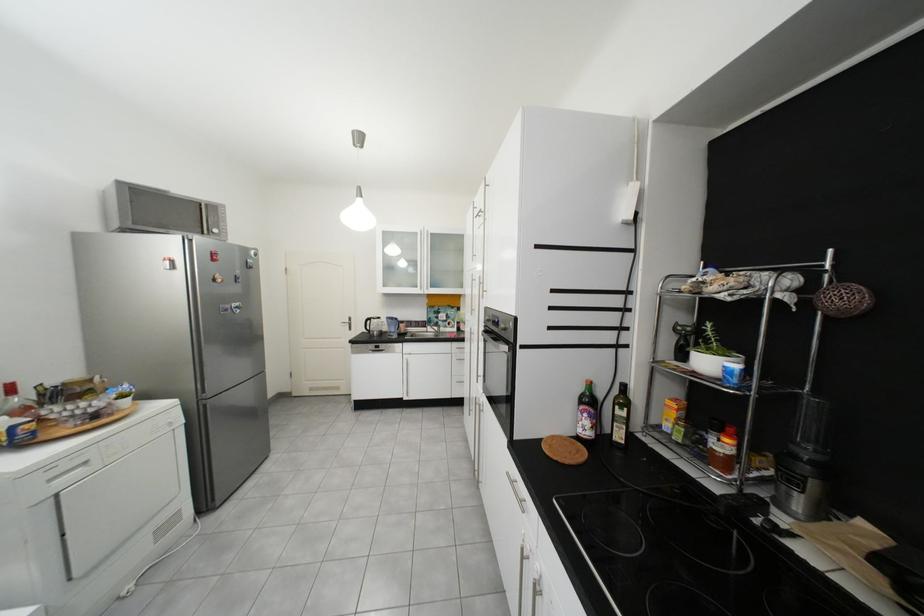
Describe the element at coordinates (805, 464) in the screenshot. The image size is (924, 616). I see `a blender jar` at that location.